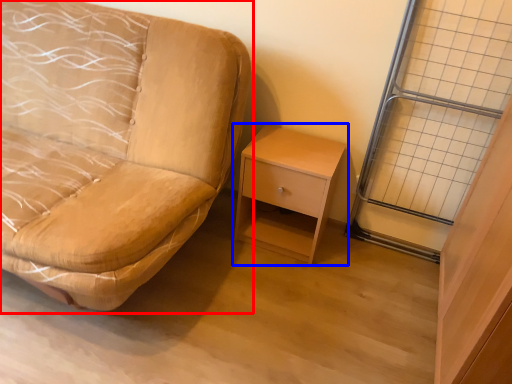
Question: Which object appears closest to the camera in this image, studio couch (highlighted by a red box) or nightstand (highlighted by a blue box)?

Choices:
 (A) studio couch
 (B) nightstand

Answer: (A)